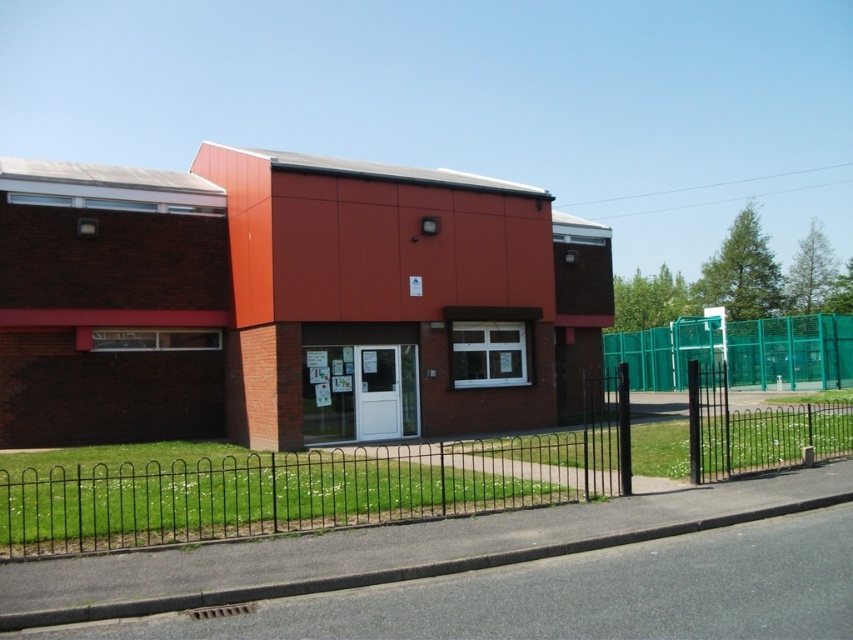
The image size is (853, 640). What do you see at coordinates (312, 486) in the screenshot?
I see `black wrought iron fence at center` at bounding box center [312, 486].

Between black wrought iron fence at center and green mesh fence at center, which one has less height?

Standing shorter between the two is black wrought iron fence at center.

This screenshot has height=640, width=853. Describe the element at coordinates (312, 486) in the screenshot. I see `black wrought iron fence at center` at that location.

Locate an element on the screen. This screenshot has height=640, width=853. black wrought iron fence at center is located at coordinates (312, 486).